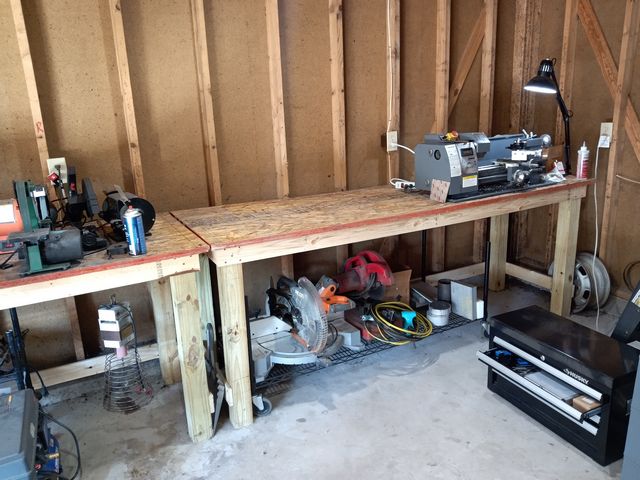
At what (x,y) coordinates should I click in order to perform the action: click on desk lamp. Please return your answer as a coordinate pair (x, y). The width and height of the screenshot is (640, 480). Looking at the image, I should click on (544, 80).